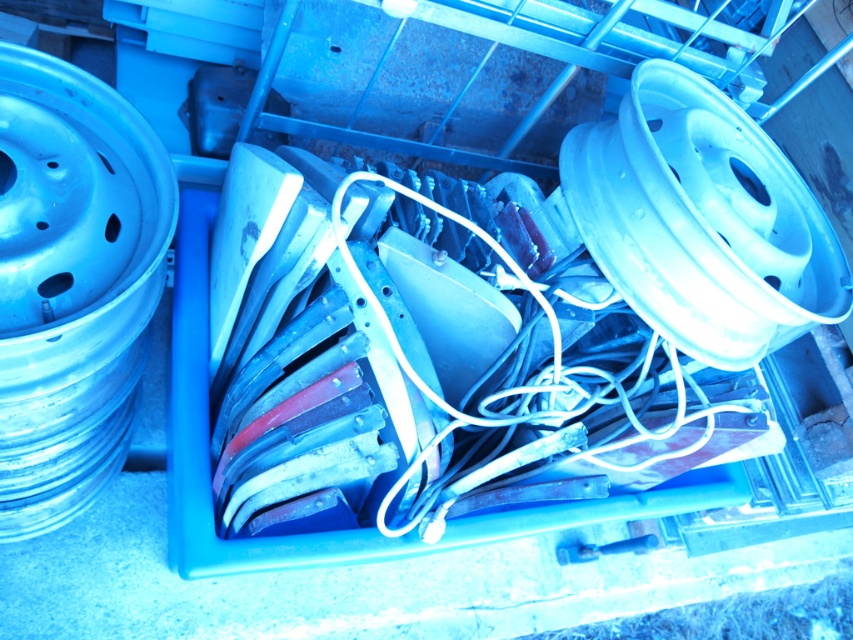
Which of these two, metallic silver rim at upper right or blue metallic rim at left, stands shorter?

With less height is blue metallic rim at left.

Who is taller, metallic silver rim at upper right or blue metallic rim at left?

metallic silver rim at upper right

Where is `metallic silver rim at upper right`? The width and height of the screenshot is (853, 640). metallic silver rim at upper right is located at coordinates (701, 220).